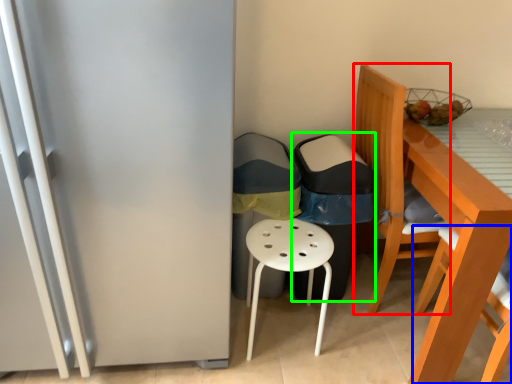
Question: Which object is the farthest from chair (highlighted by a red box)? Choose among these: chair (highlighted by a blue box) or garbage (highlighted by a green box).

Choices:
 (A) chair
 (B) garbage

Answer: (A)